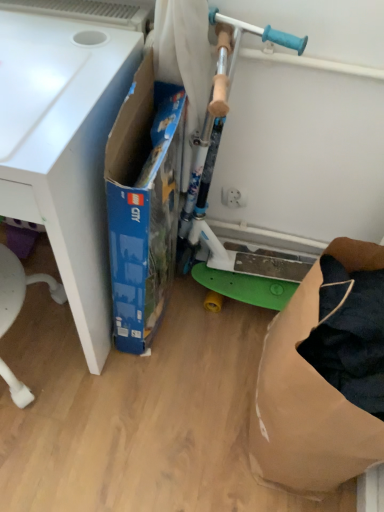
Image resolution: width=384 pixels, height=512 pixels. In order to click on vacant space to the left of brown paper bag at lower right in this screenshot , I will do `click(183, 404)`.